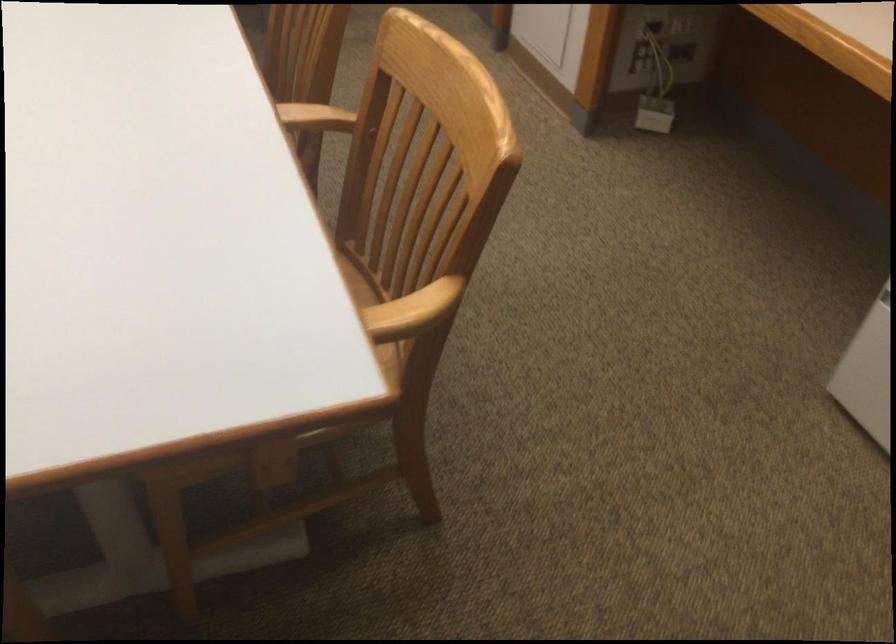
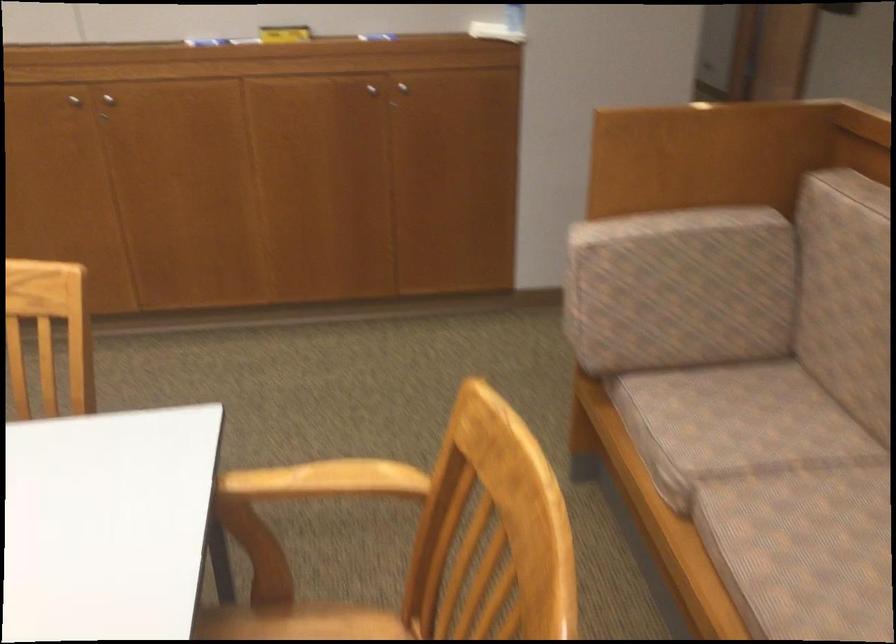
Question: In a continuous first-person perspective shot, in which direction is the camera moving?

Choices:
 (A) Left
 (B) Right
 (C) Forward
 (D) Backward

Answer: (C)